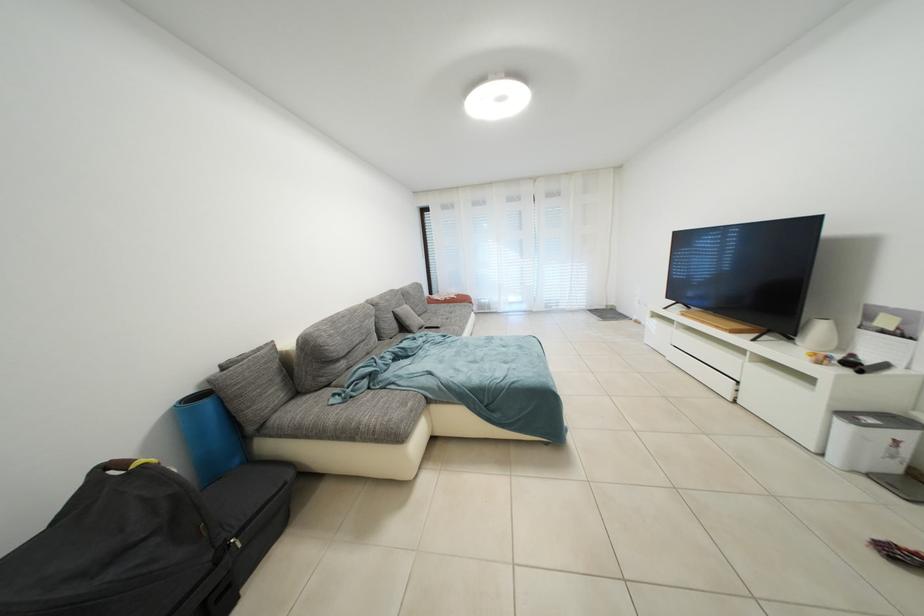
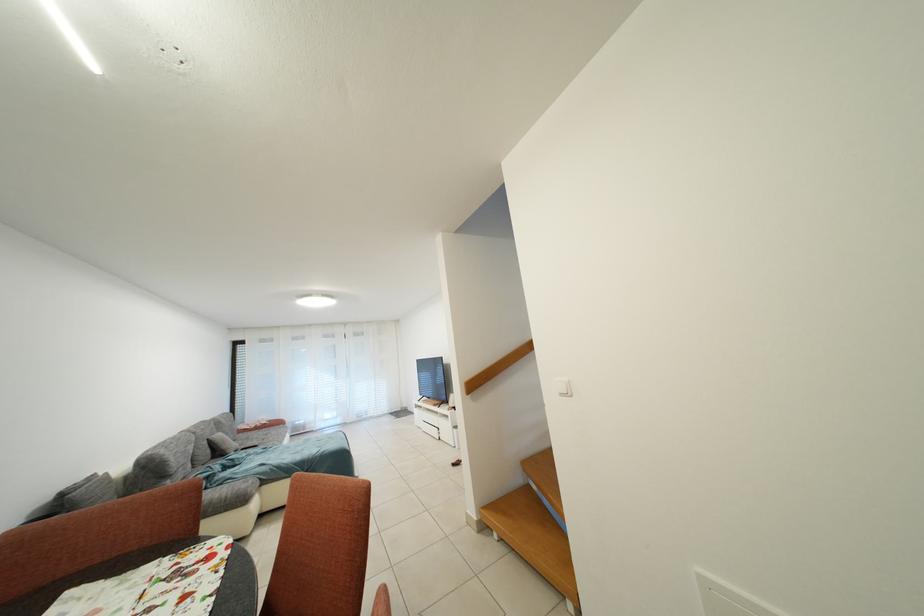
Locate, in the second image, the point that corresponds to [414,314] in the first image.

(227, 440)